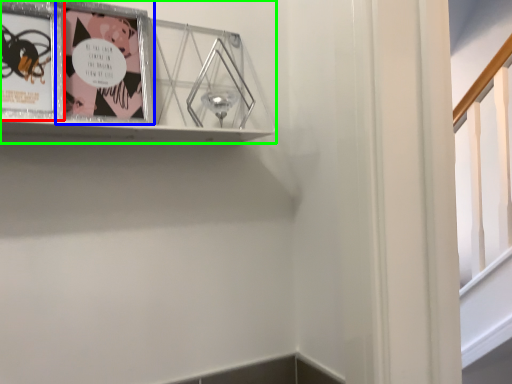
Question: Based on their relative distances, which object is nearer to picture frame (highlighted by a red box)? Choose from picture frame (highlighted by a blue box) and picture frame (highlighted by a green box).

Choices:
 (A) picture frame
 (B) picture frame

Answer: (A)